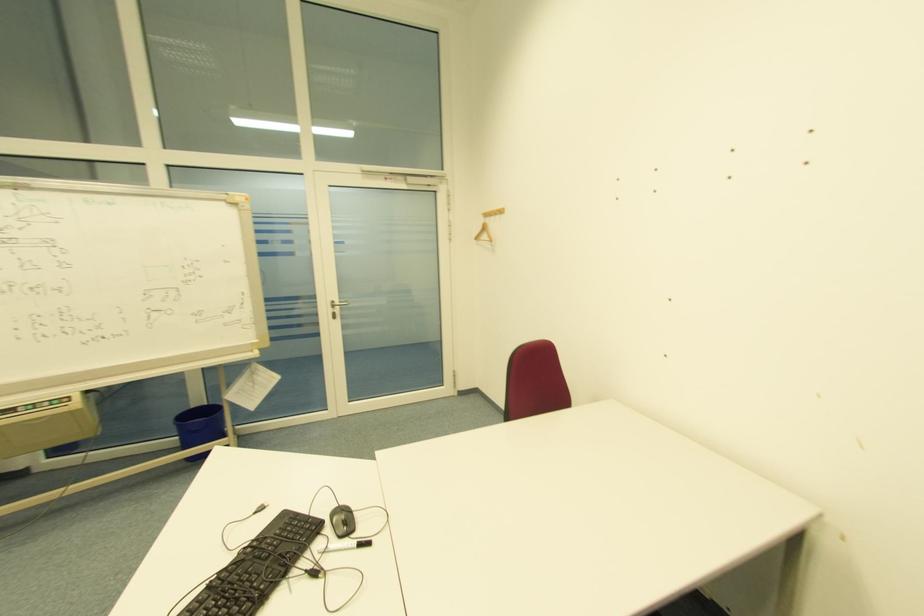
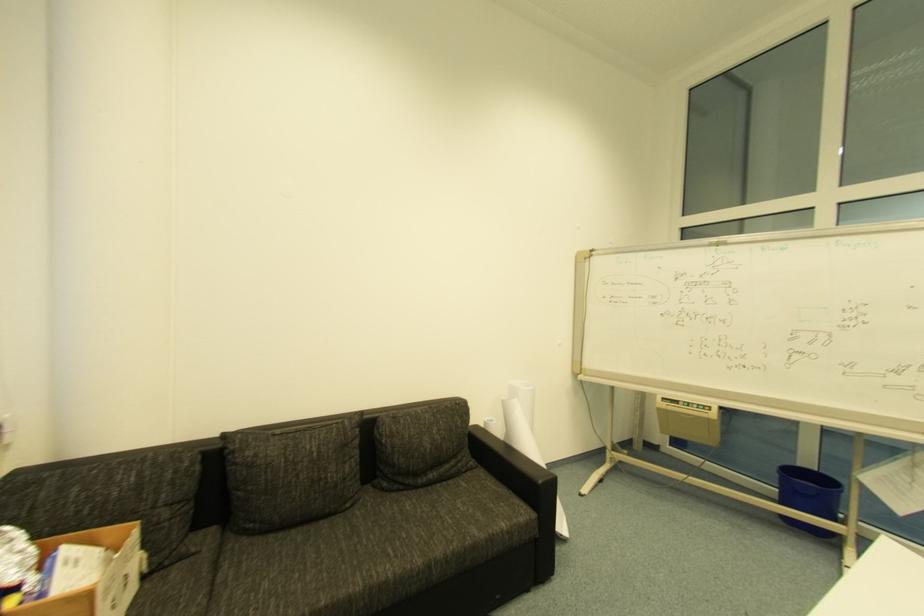
Question: The camera is either moving clockwise (left) or counter-clockwise (right) around the object. The first image is from the beginning of the video and the second image is from the end. Is the camera moving left or right when shooting the video?

Choices:
 (A) Left
 (B) Right

Answer: (B)